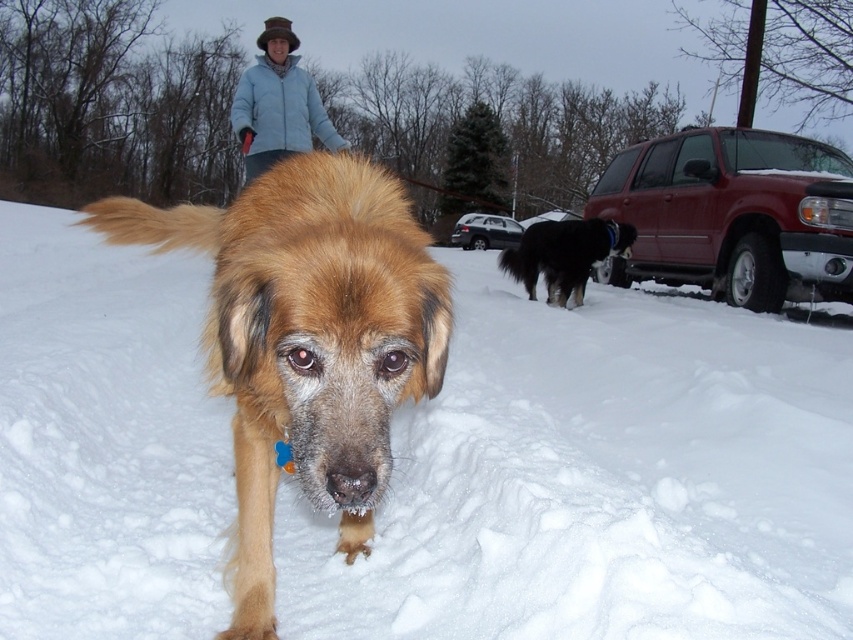
Question: Is white fluffy snow at center above black shaggy dog at right?

Choices:
 (A) yes
 (B) no

Answer: (B)

Question: Can you confirm if light blue fabric at upper center is positioned below black shaggy dog at right?

Choices:
 (A) yes
 (B) no

Answer: (B)

Question: Is light blue fabric at upper center further to camera compared to black shaggy dog at right?

Choices:
 (A) yes
 (B) no

Answer: (B)

Question: Estimate the real-world distances between objects in this image. Which object is farther from the white fluffy snow at center?

Choices:
 (A) golden fur dog at center
 (B) black shaggy dog at right

Answer: (B)

Question: Which object is closer to the camera taking this photo?

Choices:
 (A) white fluffy snow at center
 (B) black shaggy dog at right
 (C) golden fur dog at center
 (D) light blue fabric at upper center

Answer: (C)

Question: Considering the real-world distances, which object is closest to the golden fur dog at center?

Choices:
 (A) black shaggy dog at right
 (B) light blue fabric at upper center
 (C) white fluffy snow at center

Answer: (C)